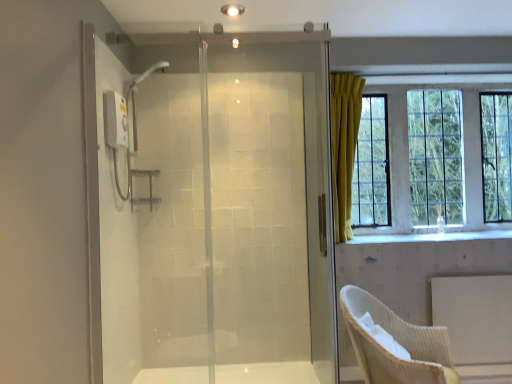
Looking at this image, measure the distance between point (x=397, y=182) and camera.

Point (x=397, y=182) and camera are 10.89 feet apart.

Identify the location of woven beige chair at lower right. (397, 341).

Measure the distance between point (262, 50) and camera.

Point (262, 50) and camera are 2.93 meters apart from each other.

You are a GUI agent. You are given a task and a screenshot of the screen. Output one action in this format:
    pyautogui.click(x=<x>, y=<y>)
    Task: Click on the yellow fabric curtain at upper right
    This screenshot has width=512, height=384.
    Given the screenshot: What is the action you would take?
    pyautogui.click(x=408, y=152)

Considering the positions of objects yellow fabric curtain at upper right and transparent glass shower door at center in the image provided, who is in front, yellow fabric curtain at upper right or transparent glass shower door at center?

transparent glass shower door at center is closer to the camera.

How different are the orientations of yellow fabric curtain at upper right and transparent glass shower door at center in degrees?

0.712 degrees separate the facing orientations of yellow fabric curtain at upper right and transparent glass shower door at center.

From the picture: From a real-world perspective, is yellow fabric curtain at upper right physically located above or below transparent glass shower door at center?

yellow fabric curtain at upper right is situated higher than transparent glass shower door at center in the real world.

Considering the sizes of objects yellow fabric curtain at upper right and transparent glass shower door at center in the image provided, who is thinner, yellow fabric curtain at upper right or transparent glass shower door at center?

With smaller width is transparent glass shower door at center.

Which is more to the left, woven beige chair at lower right or transparent glass shower door at center?

Positioned to the left is transparent glass shower door at center.

Could you tell me if woven beige chair at lower right is facing transparent glass shower door at center?

No, woven beige chair at lower right is not oriented towards transparent glass shower door at center.

How different are the orientations of woven beige chair at lower right and transparent glass shower door at center in degrees?

The angular difference between woven beige chair at lower right and transparent glass shower door at center is 62.4 degrees.

Identify the location of window behind the woven beige chair at lower right. The width and height of the screenshot is (512, 384). (408, 152).

From the image's perspective, between woven beige chair at lower right and yellow fabric curtain at upper right, who is located below?

woven beige chair at lower right is shown below in the image.

In the scene shown: Considering the relative sizes of woven beige chair at lower right and yellow fabric curtain at upper right in the image provided, is woven beige chair at lower right thinner than yellow fabric curtain at upper right?

Incorrect, the width of woven beige chair at lower right is not less than that of yellow fabric curtain at upper right.

From their relative heights in the image, would you say woven beige chair at lower right is taller or shorter than yellow fabric curtain at upper right?

In the image, woven beige chair at lower right appears to be shorter than yellow fabric curtain at upper right.

Which is more to the left, transparent glass shower door at center or woven beige chair at lower right?

Positioned to the left is transparent glass shower door at center.

From the picture: Is transparent glass shower door at center located outside woven beige chair at lower right?

transparent glass shower door at center lies outside woven beige chair at lower right's area.

From the image's perspective, does transparent glass shower door at center appear higher than woven beige chair at lower right?

Yes.

Is transparent glass shower door at center looking in the opposite direction of woven beige chair at lower right?

transparent glass shower door at center is not turned away from woven beige chair at lower right.

Which point is more distant from viewer, (x=124, y=187) or (x=472, y=108)?

The point (x=472, y=108) is farther from the camera.

Considering the sizes of transparent glass shower door at center and yellow fabric curtain at upper right in the image, is transparent glass shower door at center bigger or smaller than yellow fabric curtain at upper right?

In the image, transparent glass shower door at center appears to be smaller than yellow fabric curtain at upper right.

From the image's perspective, is transparent glass shower door at center above or below yellow fabric curtain at upper right?

From the image's perspective, transparent glass shower door at center appears below yellow fabric curtain at upper right.

Consider the image. Is transparent glass shower door at center aimed at yellow fabric curtain at upper right?

No, transparent glass shower door at center does not turn towards yellow fabric curtain at upper right.

Find the location of a particular element. chair below the yellow fabric curtain at upper right (from the image's perspective) is located at coordinates (397, 341).

Is yellow fabric curtain at upper right oriented away from woven beige chair at lower right?

No, woven beige chair at lower right is not at the back of yellow fabric curtain at upper right.

Considering the relative positions of yellow fabric curtain at upper right and woven beige chair at lower right in the image provided, is yellow fabric curtain at upper right to the left or to the right of woven beige chair at lower right?

yellow fabric curtain at upper right is positioned on woven beige chair at lower right's right side.

Identify the location of screen door that is in front of the yellow fabric curtain at upper right. The height and width of the screenshot is (384, 512). (211, 210).

This screenshot has height=384, width=512. Find the location of `chair below the transparent glass shower door at center (from the image's perspective)`. chair below the transparent glass shower door at center (from the image's perspective) is located at coordinates (397, 341).

Estimate the real-world distances between objects in this image. Which object is closer to woven beige chair at lower right, yellow fabric curtain at upper right or transparent glass shower door at center?

The object closer to woven beige chair at lower right is transparent glass shower door at center.

Estimate the real-world distances between objects in this image. Which object is further from yellow fabric curtain at upper right, transparent glass shower door at center or woven beige chair at lower right?

Among the two, transparent glass shower door at center is located further to yellow fabric curtain at upper right.

When comparing their distances from yellow fabric curtain at upper right, does woven beige chair at lower right or transparent glass shower door at center seem further?

Based on the image, transparent glass shower door at center appears to be further to yellow fabric curtain at upper right.

Which object lies further to the anchor point transparent glass shower door at center, woven beige chair at lower right or yellow fabric curtain at upper right?

yellow fabric curtain at upper right lies further to transparent glass shower door at center than the other object.

Looking at the image, which one is located further to transparent glass shower door at center, yellow fabric curtain at upper right or woven beige chair at lower right?

yellow fabric curtain at upper right.

Which object lies further to the anchor point woven beige chair at lower right, transparent glass shower door at center or yellow fabric curtain at upper right?

yellow fabric curtain at upper right.

Find the location of a particular element. The width and height of the screenshot is (512, 384). chair between transparent glass shower door at center and yellow fabric curtain at upper right from left to right is located at coordinates (397, 341).